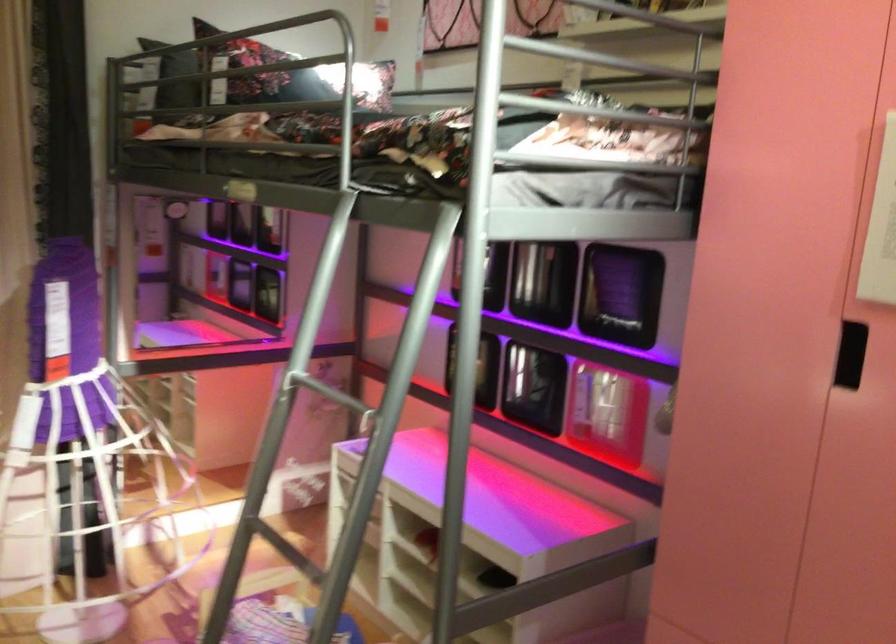
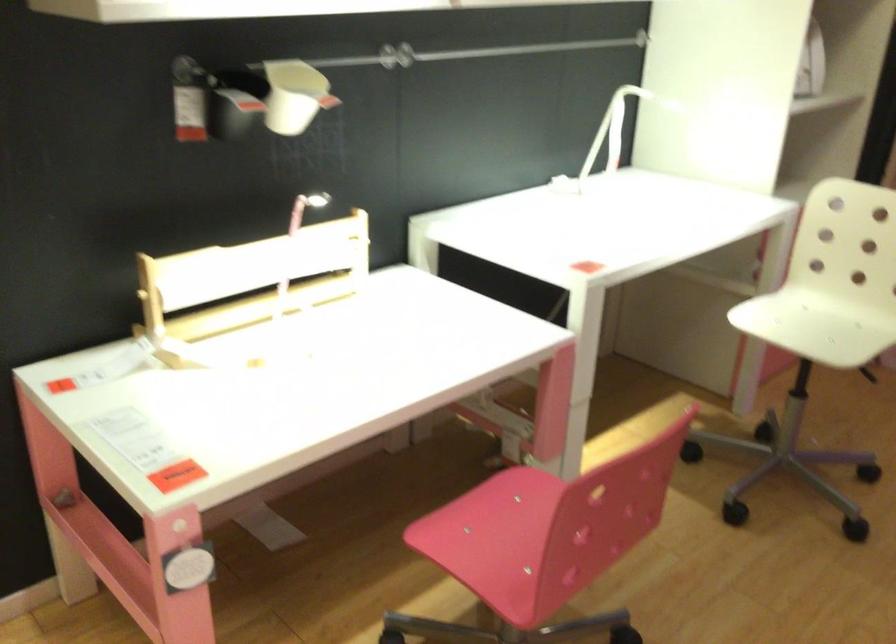
How did the camera likely rotate?

The camera rotated toward left-down.